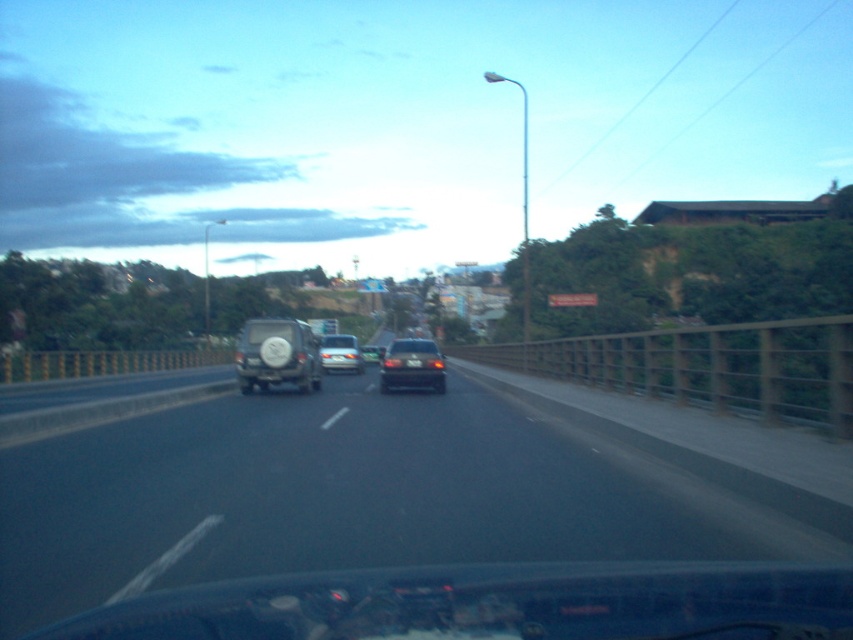
Question: Does black asphalt highway at center lie in front of black plastic license plate at center?

Choices:
 (A) no
 (B) yes

Answer: (B)

Question: Which is farther from the matte black suv at center?

Choices:
 (A) black plastic license plate at center
 (B) satin silver sedan at center

Answer: (B)

Question: Which point is closer to the camera?

Choices:
 (A) (421, 362)
 (B) (427, 358)

Answer: (A)

Question: Considering the real-world distances, which object is closest to the matte black suv at center?

Choices:
 (A) black asphalt highway at center
 (B) satin silver sedan at center
 (C) black plastic license plate at center

Answer: (C)

Question: In this image, where is black asphalt highway at center located relative to satin silver sedan at center?

Choices:
 (A) right
 (B) left

Answer: (A)

Question: Does satin black sedan at center come behind satin silver sedan at center?

Choices:
 (A) yes
 (B) no

Answer: (B)